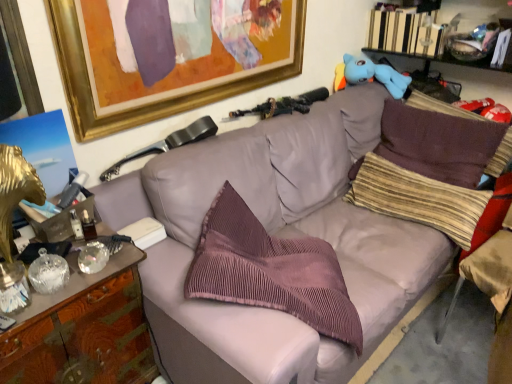
Question: From a real-world perspective, relative to pink corduroy pillow at center, placed as the third pillow when sorted from right to left, is hardcover book at upper right, arranged as the first book when viewed from the top, vertically above or below?

Choices:
 (A) above
 (B) below

Answer: (A)

Question: Is hardcover book at upper right, which ranks as the first book in right-to-left order, taller or shorter than pink corduroy pillow at center, acting as the 1th pillow starting from the left?

Choices:
 (A) tall
 (B) short

Answer: (B)

Question: Estimate the real-world distances between objects in this image. Which object is farther from the white paper at center, the second book from the right?

Choices:
 (A) brown corduroy pillow at right, the 3th pillow from the left
 (B) hardcover book at upper right, arranged as the first book when viewed from the top
 (C) blue plush toy at upper right
 (D) matte gray couch at center
 (E) wooden cabinet at left

Answer: (B)

Question: Estimate the real-world distances between objects in this image. Which object is closer to the pink corduroy pillow at center, placed as the third pillow when sorted from right to left?

Choices:
 (A) matte gray swivel chair at upper center
 (B) wooden cabinet at left
 (C) matte gray couch at center
 (D) blue plush toy at upper right
 (E) white paper at center, the second book from the right

Answer: (C)